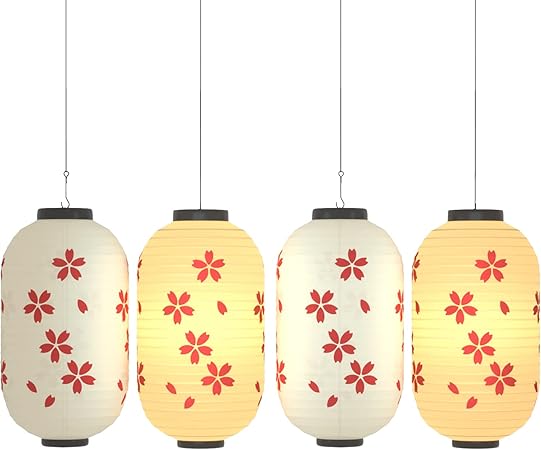
Find the location of a particular element. This screenshot has height=450, width=541. bottom of lantern is located at coordinates (65, 446), (204, 444), (345, 442), (484, 442).